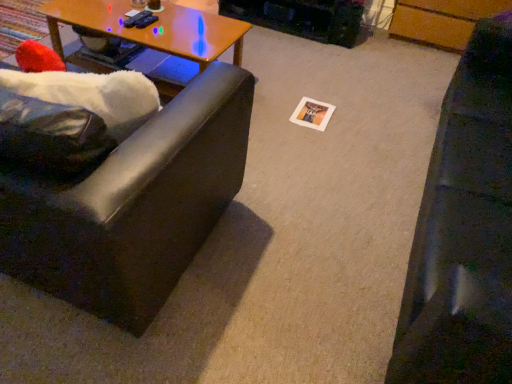
Question: Could you tell me if wooden at left is turned towards matte brown coffee cup at upper center?

Choices:
 (A) no
 (B) yes

Answer: (A)

Question: From the image's perspective, is wooden at left over matte brown coffee cup at upper center?

Choices:
 (A) no
 (B) yes

Answer: (A)

Question: Can you confirm if wooden at left is positioned to the right of matte brown coffee cup at upper center?

Choices:
 (A) no
 (B) yes

Answer: (A)

Question: Is wooden at left behind matte brown coffee cup at upper center?

Choices:
 (A) yes
 (B) no

Answer: (B)

Question: From the image's perspective, is wooden at left located beneath matte brown coffee cup at upper center?

Choices:
 (A) yes
 (B) no

Answer: (A)

Question: Is matte black couch at left, which is counted as the first studio couch, starting from the left, wider or thinner than matte brown coffee cup at upper center?

Choices:
 (A) wide
 (B) thin

Answer: (A)

Question: From the image's perspective, is matte black couch at left, which is counted as the 2th studio couch, starting from the right, positioned above or below matte brown coffee cup at upper center?

Choices:
 (A) above
 (B) below

Answer: (B)

Question: In terms of size, does matte black couch at left, which is counted as the 2th studio couch, starting from the right, appear bigger or smaller than matte brown coffee cup at upper center?

Choices:
 (A) big
 (B) small

Answer: (A)

Question: From a real-world perspective, is matte black couch at left, which is counted as the first studio couch, starting from the left, positioned above or below matte brown coffee cup at upper center?

Choices:
 (A) above
 (B) below

Answer: (B)

Question: Is matte brown coffee cup at upper center in front of or behind wooden at left in the image?

Choices:
 (A) behind
 (B) front

Answer: (A)

Question: From a real-world perspective, relative to wooden at left, is matte brown coffee cup at upper center vertically above or below?

Choices:
 (A) below
 (B) above

Answer: (B)

Question: In terms of height, does matte brown coffee cup at upper center look taller or shorter compared to wooden at left?

Choices:
 (A) tall
 (B) short

Answer: (B)

Question: From the image's perspective, is matte brown coffee cup at upper center located above or below wooden at left?

Choices:
 (A) above
 (B) below

Answer: (A)

Question: Looking at the image, does wooden at left seem bigger or smaller compared to black leather couch at right, which is counted as the 1th studio couch, starting from the right?

Choices:
 (A) small
 (B) big

Answer: (A)

Question: In the image, is wooden at left positioned in front of or behind black leather couch at right, the second studio couch positioned from the left?

Choices:
 (A) front
 (B) behind

Answer: (B)